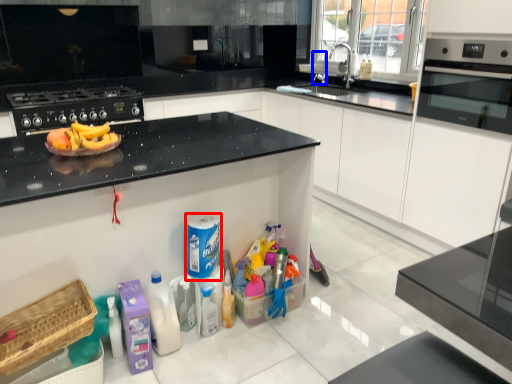
Question: Which object appears closest to the camera in this image, cleaning product (highlighted by a red box) or faucet (highlighted by a blue box)?

Choices:
 (A) cleaning product
 (B) faucet

Answer: (A)